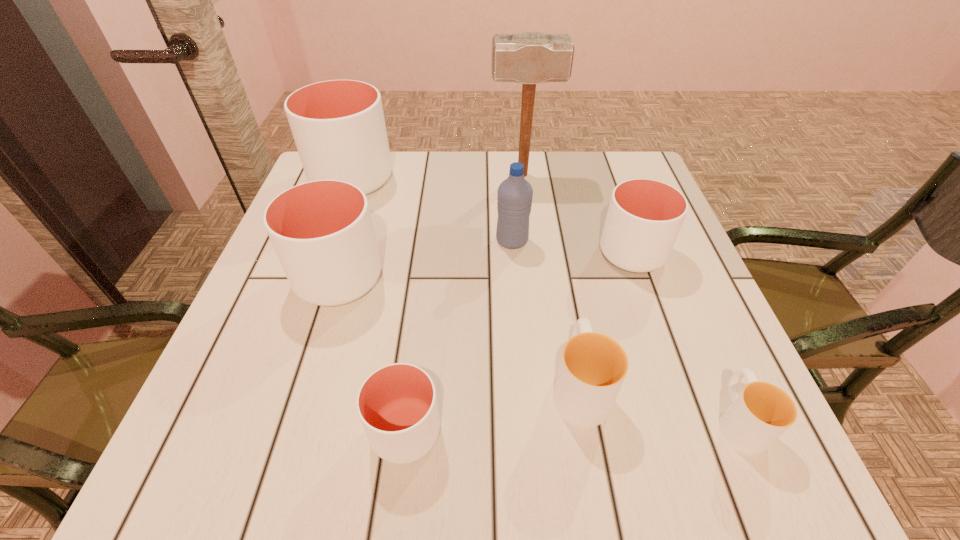
Identify the location of free region located with the handle on the side of the third cup from right to left. (563, 288).

Locate an element on the screen. Image resolution: width=960 pixels, height=540 pixels. vacant space positioned 0.250m with the handle on the side of the third cup from right to left is located at coordinates (556, 254).

The height and width of the screenshot is (540, 960). Find the location of `free spot located 0.210m with the handle on the side of the third cup from right to left`. free spot located 0.210m with the handle on the side of the third cup from right to left is located at coordinates (559, 267).

Image resolution: width=960 pixels, height=540 pixels. Find the location of `blank area located on the right of the sixth object from right to left`. blank area located on the right of the sixth object from right to left is located at coordinates (642, 431).

At what (x,y) coordinates should I click in order to perform the action: click on vacant region located 0.360m with the handle on the side of the right yellow cup. Please return your answer as a coordinate pair (x, y). The image size is (960, 540). Looking at the image, I should click on (662, 245).

This screenshot has height=540, width=960. Find the location of `vacant region located 0.230m with the handle on the side of the right yellow cup`. vacant region located 0.230m with the handle on the side of the right yellow cup is located at coordinates (681, 288).

The image size is (960, 540). What are the coordinates of `free location located 0.360m with the handle on the side of the right yellow cup` in the screenshot? It's located at (662, 245).

Identify the location of mallet situated at the far edge. Image resolution: width=960 pixels, height=540 pixels. (530, 58).

Locate an element on the screen. The height and width of the screenshot is (540, 960). cup present at the far edge is located at coordinates [338, 126].

Where is `object positioned at the far left corner`? This screenshot has width=960, height=540. object positioned at the far left corner is located at coordinates (338, 126).